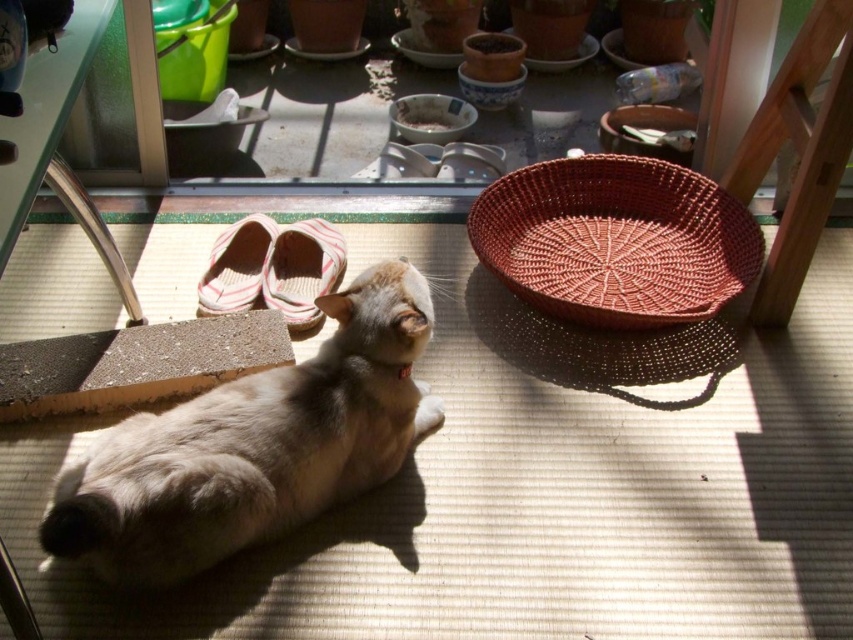
Question: Does striped fabric shoe at center lie in front of striped fabric slipper at lower left?

Choices:
 (A) no
 (B) yes

Answer: (B)

Question: Which is farther from the light brown fur cat at center?

Choices:
 (A) striped fabric slipper at lower left
 (B) striped fabric shoe at center
 (C) brown woven basket at lower right

Answer: (C)

Question: Which of the following is the farthest from the observer?

Choices:
 (A) light brown fur cat at center
 (B) striped fabric shoe at center
 (C) brown woven basket at lower right
 (D) striped fabric slipper at lower left

Answer: (D)

Question: Estimate the real-world distances between objects in this image. Which object is closer to the striped fabric slipper at lower left?

Choices:
 (A) striped fabric shoe at center
 (B) brown woven basket at lower right

Answer: (A)

Question: Is brown woven basket at lower right in front of striped fabric shoe at center?

Choices:
 (A) no
 (B) yes

Answer: (B)

Question: Does striped fabric shoe at center appear on the left side of striped fabric slipper at lower left?

Choices:
 (A) yes
 (B) no

Answer: (B)